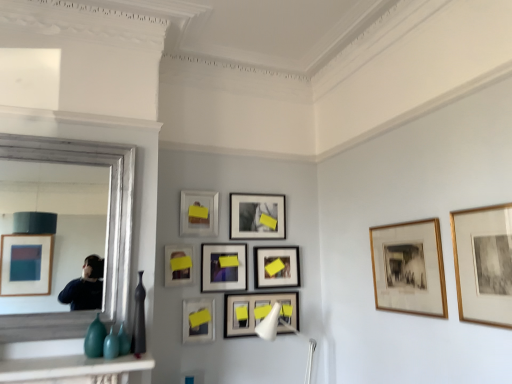
Question: Choose the correct answer: Is gold-framed print at center-right, marked as the 8th picture frame in a back-to-front arrangement, inside matte black vase at left or outside it?

Choices:
 (A) outside
 (B) inside

Answer: (A)

Question: Is gold-framed print at center-right, acting as the 2th picture frame starting from the front, bigger or smaller than matte black vase at left?

Choices:
 (A) small
 (B) big

Answer: (B)

Question: Which is nearer to the marble white mantelpiece at lower left?

Choices:
 (A) white plastic lamp at center
 (B) matte black picture frame at center, the ninth picture frame when ordered from front to back
 (C) matte black picture frame at center, positioned as the 2th picture frame in back-to-front order
 (D) teal glass vase at lower left
 (E) matte black picture frame at lower center, which ranks as the 4th picture frame in back-to-front order

Answer: (D)

Question: Considering the real-world distances, which object is farthest from the silver framed mirror at left?

Choices:
 (A) gold-framed print at center-right, marked as the 8th picture frame in a back-to-front arrangement
 (B) matte black vase at left
 (C) matte black picture frame at center, the 3th picture frame positioned from the back
 (D) matte black picture frame at center, which ranks as the third picture frame in front-to-back order
 (E) marble white mantelpiece at lower left

Answer: (A)